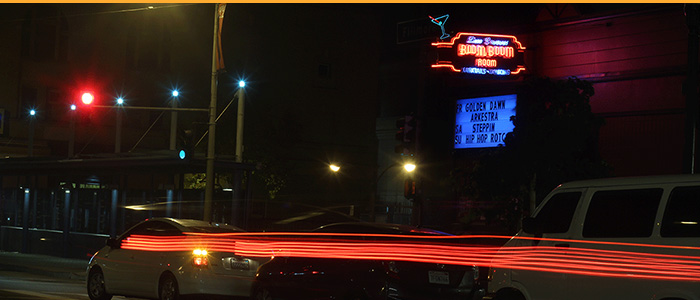
At what (x,y) coordinates should I click in order to perform the action: click on lights. Please return your answer as a coordinate pair (x, y). Image resolution: width=700 pixels, height=300 pixels. Looking at the image, I should click on click(x=87, y=97), click(x=119, y=100), click(x=176, y=92), click(x=242, y=80), click(x=330, y=165), click(x=411, y=166), click(x=33, y=110), click(x=71, y=106), click(x=196, y=251), click(x=147, y=242).